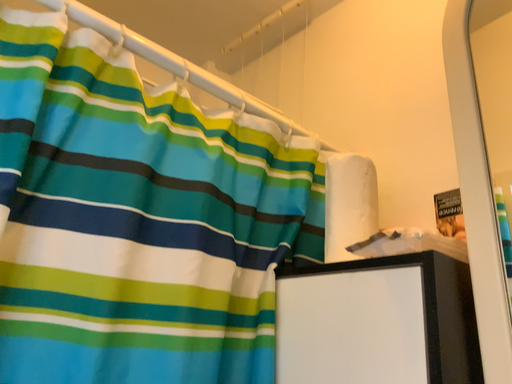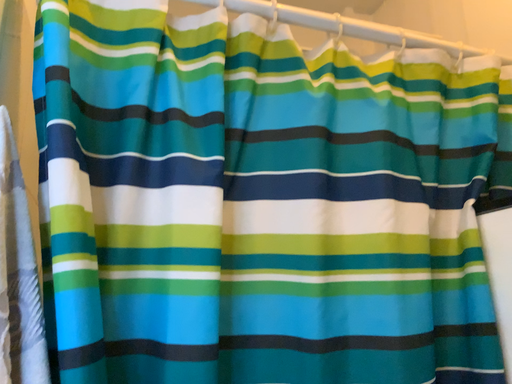
Question: How did the camera likely rotate when shooting the video?

Choices:
 (A) rotated right
 (B) rotated left

Answer: (B)